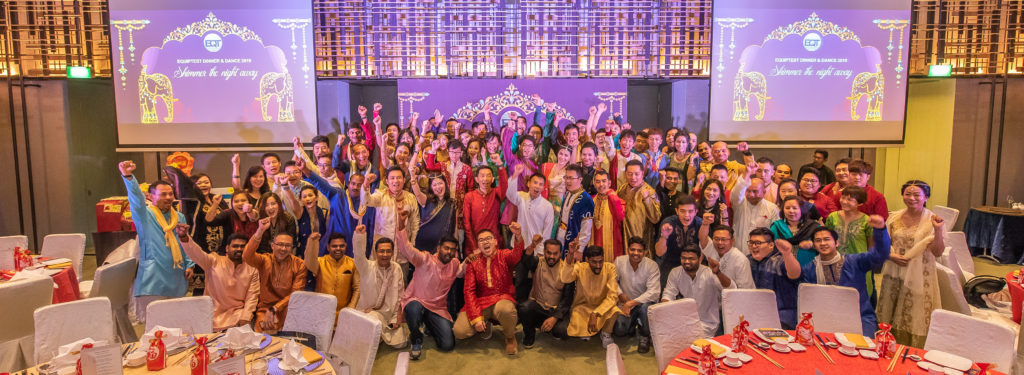
Find the location of a particular element. exit sign is located at coordinates (942, 73).